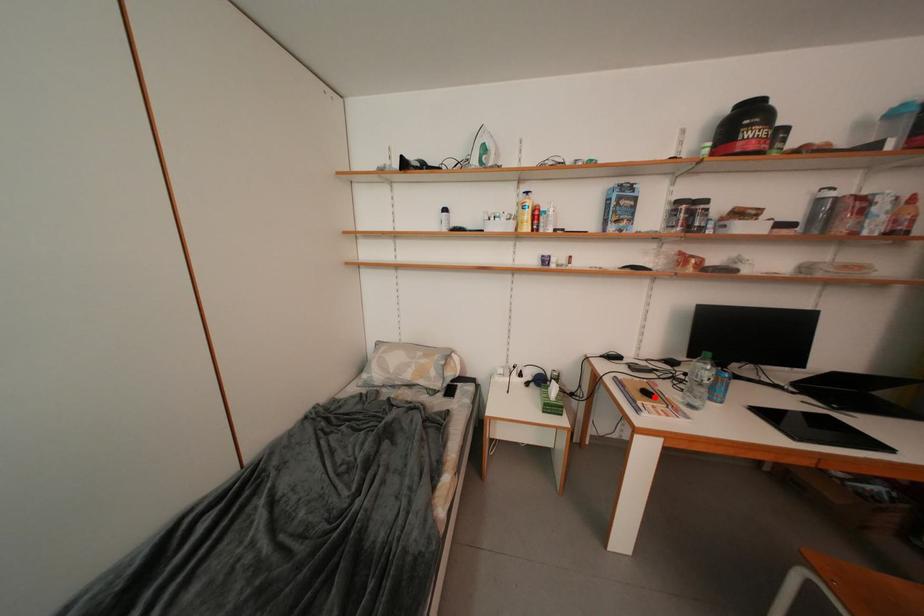
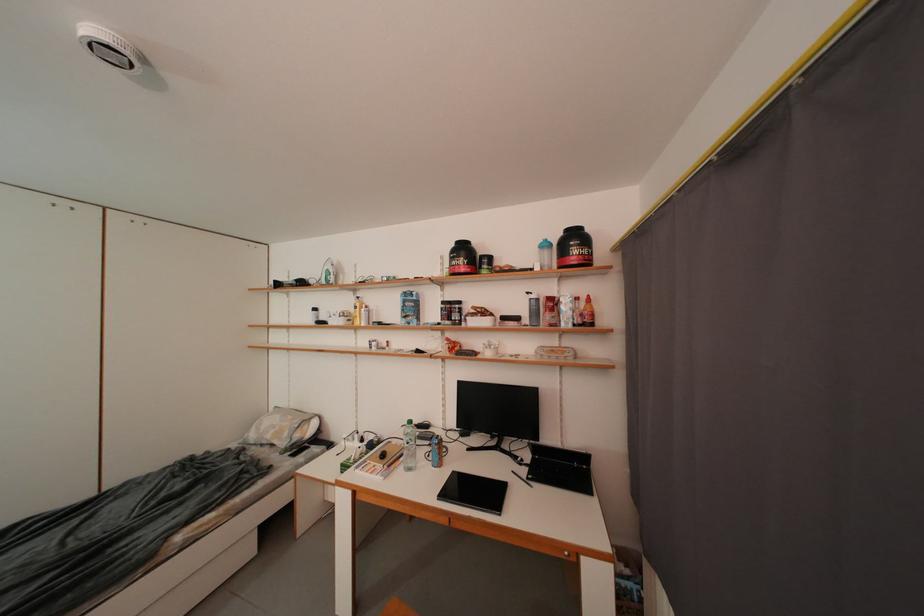
Question: I am providing you with two images of the same scene from different viewpoints. Given a red point in image1, look at the same physical point in image2. Is it:

Choices:
 (A) Closer to the viewpoint
 (B) Farther from the viewpoint

Answer: (B)